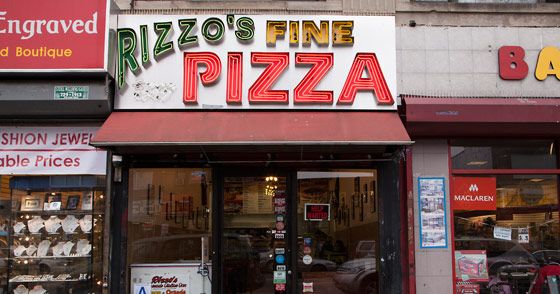
At what (x,y) coordinates should I click in order to perform the action: click on glass. Please return your answer as a coordinate pair (x, y). Looking at the image, I should click on (371, 195).